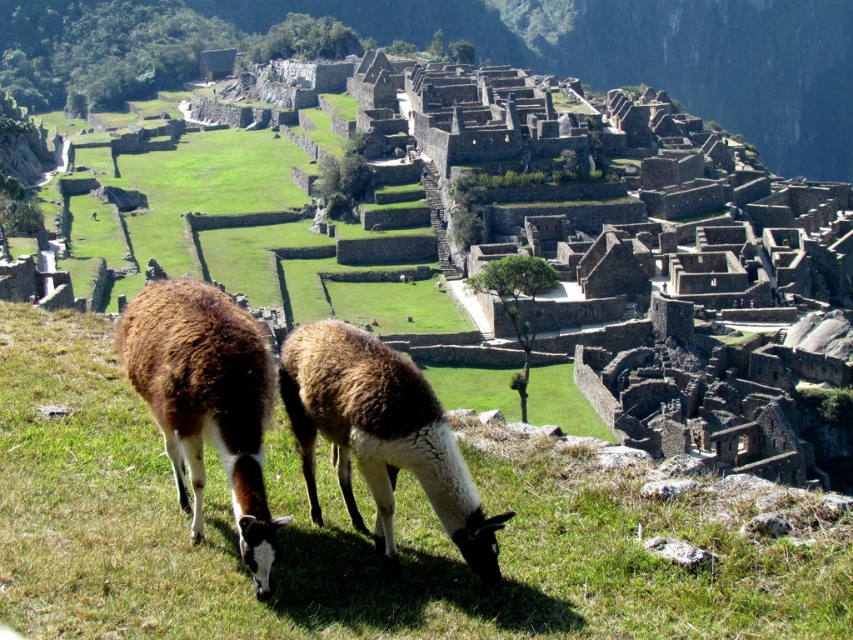
Question: Does brown woolly alpaca at center come in front of brown woolly alpaca at lower left?

Choices:
 (A) yes
 (B) no

Answer: (B)

Question: Does green grass at center have a greater width compared to brown woolly alpaca at lower left?

Choices:
 (A) yes
 (B) no

Answer: (A)

Question: Which of the following is the farthest from the observer?

Choices:
 (A) brown woolly alpaca at center
 (B) green grass at center

Answer: (A)

Question: Is brown woolly alpaca at center smaller than brown woolly alpaca at lower left?

Choices:
 (A) yes
 (B) no

Answer: (A)

Question: Which point is farther to the camera?

Choices:
 (A) brown woolly alpaca at lower left
 (B) brown woolly alpaca at center

Answer: (B)

Question: Which object is the farthest from the green grass at center?

Choices:
 (A) brown woolly alpaca at center
 (B) brown woolly alpaca at lower left

Answer: (A)